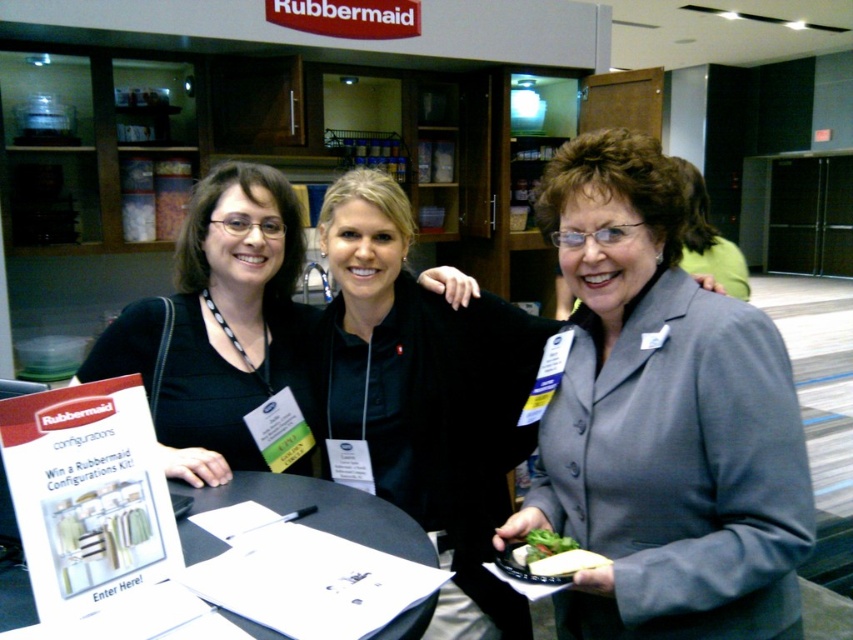
Question: Does gray matte blazer at center have a larger size compared to black plastic table at center?

Choices:
 (A) yes
 (B) no

Answer: (A)

Question: Which object is positioned closest to the gray matte blazer at center?

Choices:
 (A) green leafy salad at center
 (B) gray fabric suit at center
 (C) black plastic table at center

Answer: (A)

Question: Is gray matte blazer at center in front of green leafy salad at center?

Choices:
 (A) yes
 (B) no

Answer: (A)

Question: Which object appears farthest from the camera in this image?

Choices:
 (A) green leafy salad at center
 (B) gray matte blazer at center
 (C) gray fabric suit at center
 (D) black plastic table at center

Answer: (C)

Question: Which of the following is the farthest from the observer?

Choices:
 (A) black plastic table at center
 (B) gray matte blazer at center

Answer: (B)

Question: Is gray fabric suit at center thinner than green leafy salad at center?

Choices:
 (A) yes
 (B) no

Answer: (B)